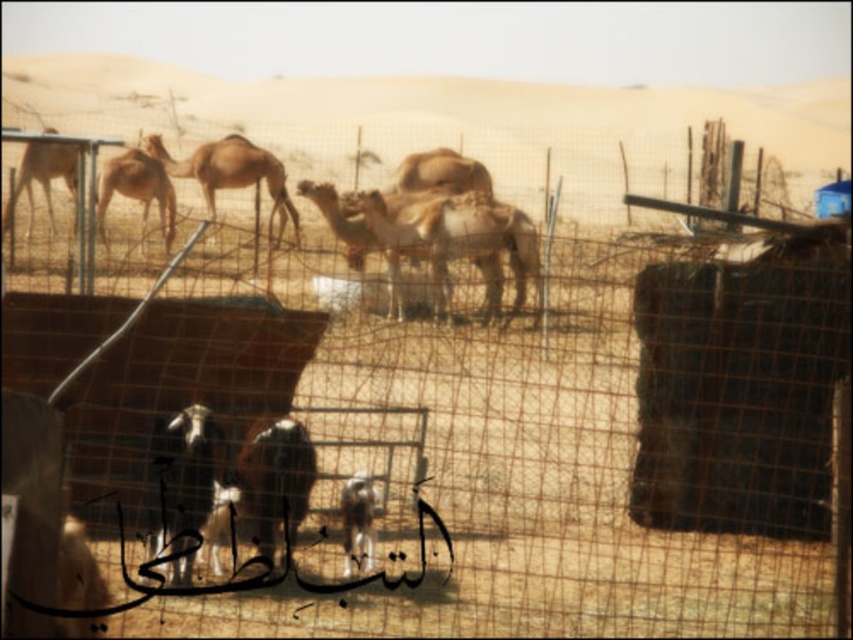
You are a visitor standing at the fence observing the camels. Which camel, the light brown fur camel at center or the light brown fur camel at left, is positioned closer to you?

The light brown fur camel at center is closer to the viewer than the light brown fur camel at left.

You are a tourist standing in front of the metal fence and want to take a photo of the light brown fur camel at center and the light brown fur camel at left. Which camel should you aim your camera towards first to capture both in the frame?

The light brown fur camel at center is located below the light brown fur camel at left, so you should aim your camera towards the light brown fur camel at left first to ensure both camels are in the frame.